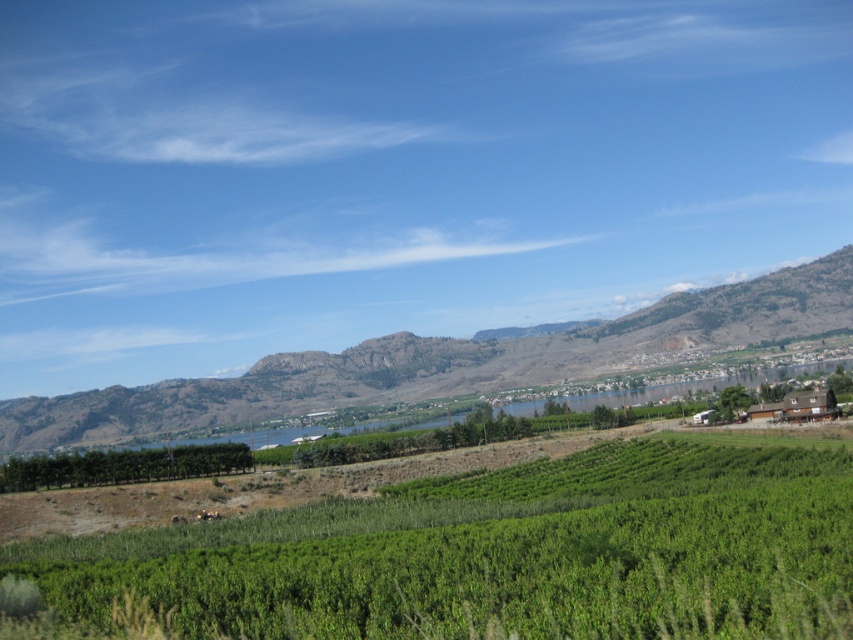
Question: Can you confirm if green leafy vineyard at center is positioned to the left of green grassy hill at left?

Choices:
 (A) yes
 (B) no

Answer: (B)

Question: Which point is farther to the camera?

Choices:
 (A) green leafy vineyard at center
 (B) green grassy hill at left

Answer: (B)

Question: Observing the image, what is the correct spatial positioning of green leafy vineyard at center in reference to green grassy hill at left?

Choices:
 (A) right
 (B) left

Answer: (A)

Question: Can you confirm if green leafy vineyard at center is positioned above green grassy hill at left?

Choices:
 (A) yes
 (B) no

Answer: (B)